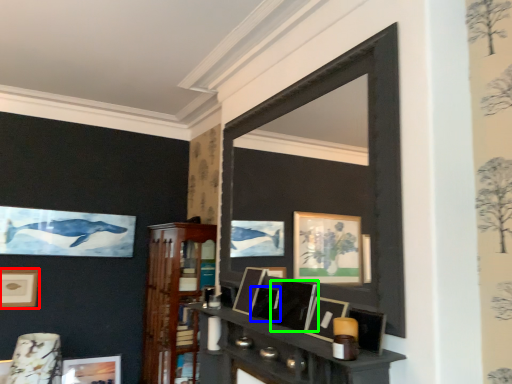
Question: Based on their relative distances, which object is farther from picture frame (highlighted by a red box)? Choose from picture frame (highlighted by a blue box) and picture frame (highlighted by a green box).

Choices:
 (A) picture frame
 (B) picture frame

Answer: (B)